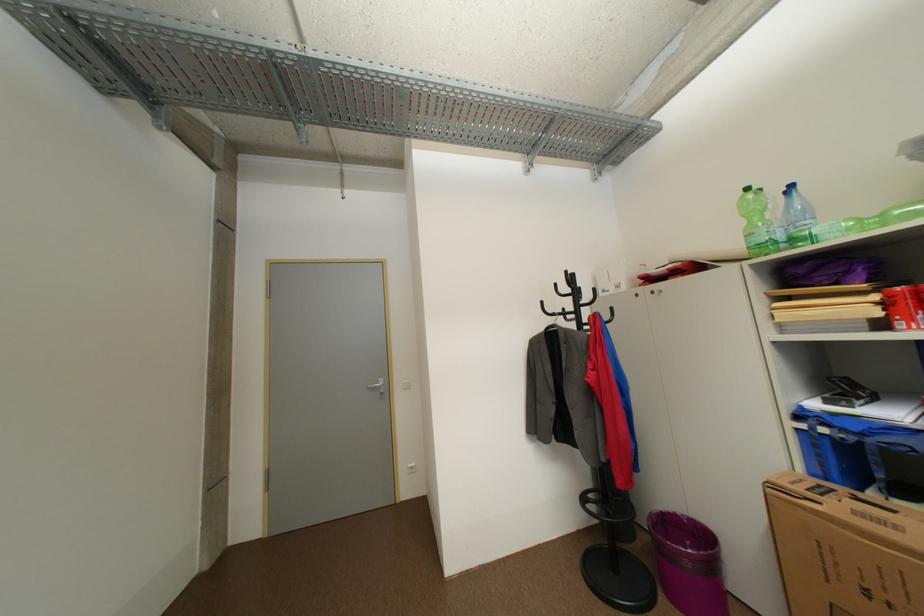
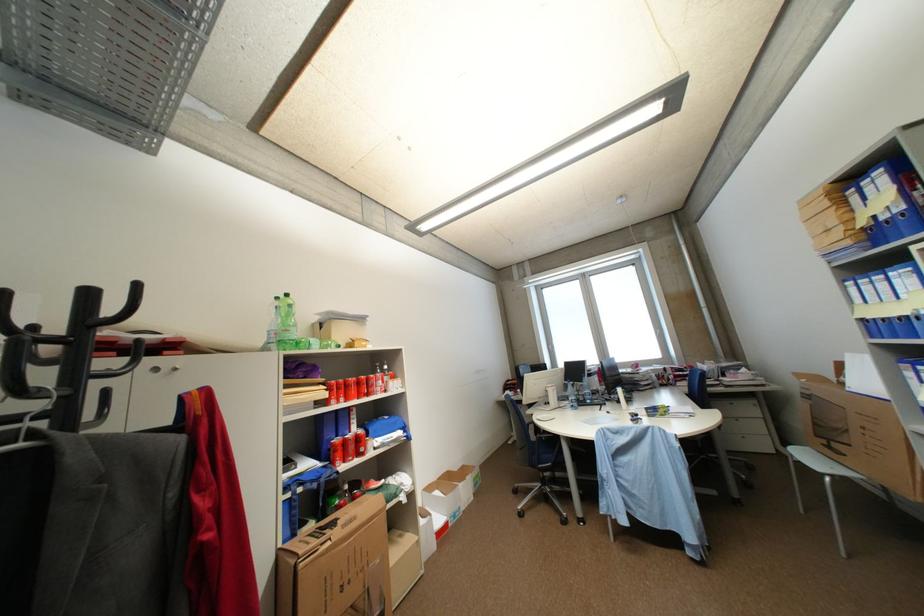
Where in the second image is the point corresponding to [888,309] from the first image?

(335, 392)